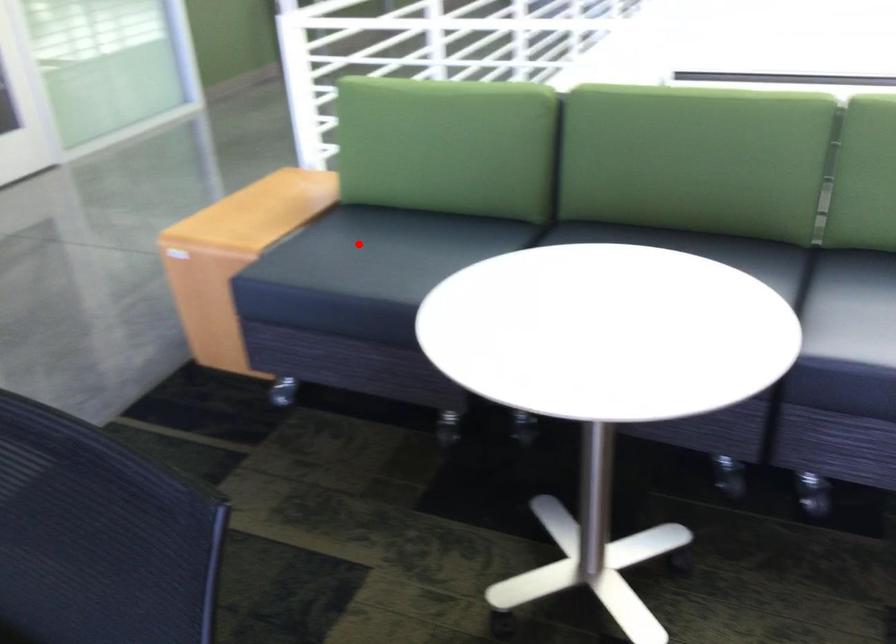
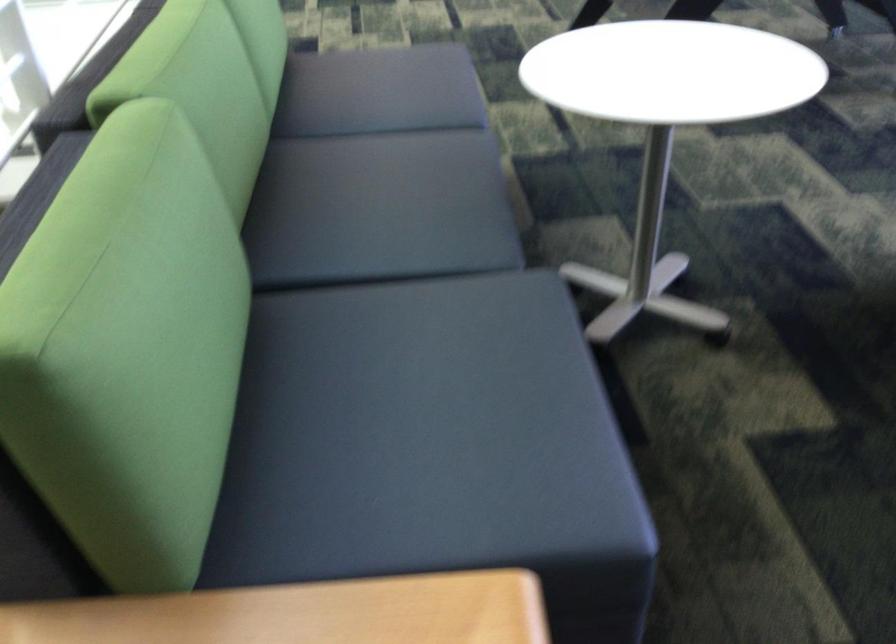
Question: I am providing you with two images of the same scene from different viewpoints. In image1, a red point is highlighted. Considering the same 3D point in image2, which of the following is correct?

Choices:
 (A) It is closer
 (B) It is farther

Answer: (A)